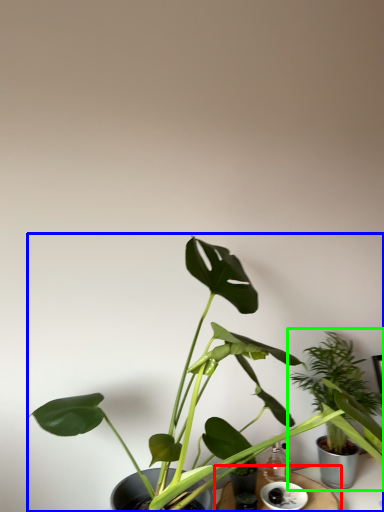
Question: Considering the real-world distances, which object is farthest from table (highlighted by a red box)? houseplant (highlighted by a blue box) or houseplant (highlighted by a green box)?

Choices:
 (A) houseplant
 (B) houseplant

Answer: (A)